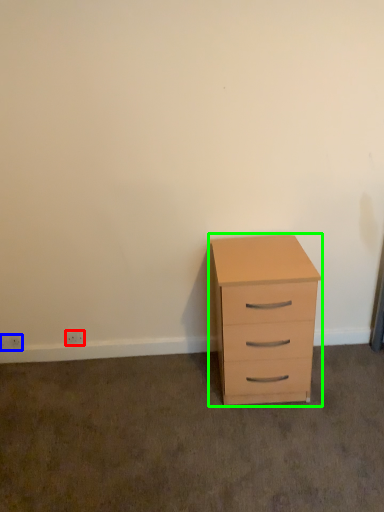
Question: Which object is positioned farthest from electric outlet (highlighted by a red box)? Select from electric outlet (highlighted by a blue box) and chest of drawers (highlighted by a green box).

Choices:
 (A) electric outlet
 (B) chest of drawers

Answer: (B)